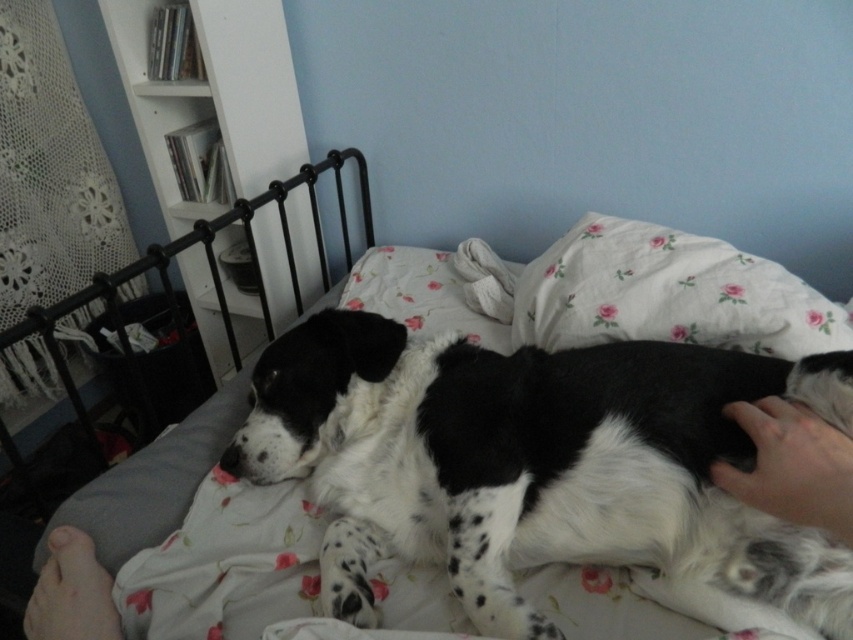
Which of these two, spotted fur dog at center or fluffy white pillow at upper right, stands taller?

With more height is spotted fur dog at center.

Is point (653, 413) in front of point (608, 326)?

That is True.

Does point (527, 529) come behind point (740, 323)?

No, it is in front of (740, 323).

Where is `spotted fur dog at center`? This screenshot has width=853, height=640. spotted fur dog at center is located at coordinates (534, 464).